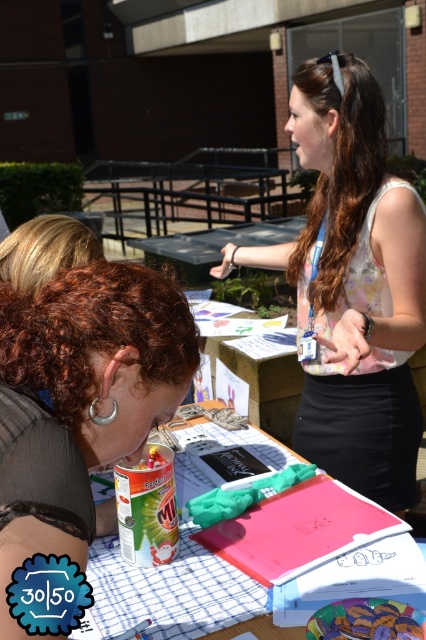
Question: Is floral fabric blouse at center thinner than curly hair at center?

Choices:
 (A) yes
 (B) no

Answer: (B)

Question: Which point is closer to the camera taking this photo?

Choices:
 (A) (419, 634)
 (B) (92, 304)
 (C) (173, 440)

Answer: (B)

Question: Can you confirm if curly hair at center is positioned above pink matte folder at center?

Choices:
 (A) no
 (B) yes

Answer: (B)

Question: Which object is farther from the camera taking this photo?

Choices:
 (A) pink matte folder at center
 (B) floral fabric blouse at center

Answer: (B)

Question: Does floral fabric blouse at center appear under matte plastic toy at center?

Choices:
 (A) no
 (B) yes

Answer: (A)

Question: Which point is farther to the camera?

Choices:
 (A) (157, 374)
 (B) (187, 545)
 (C) (388, 362)
 (D) (339, 634)

Answer: (C)